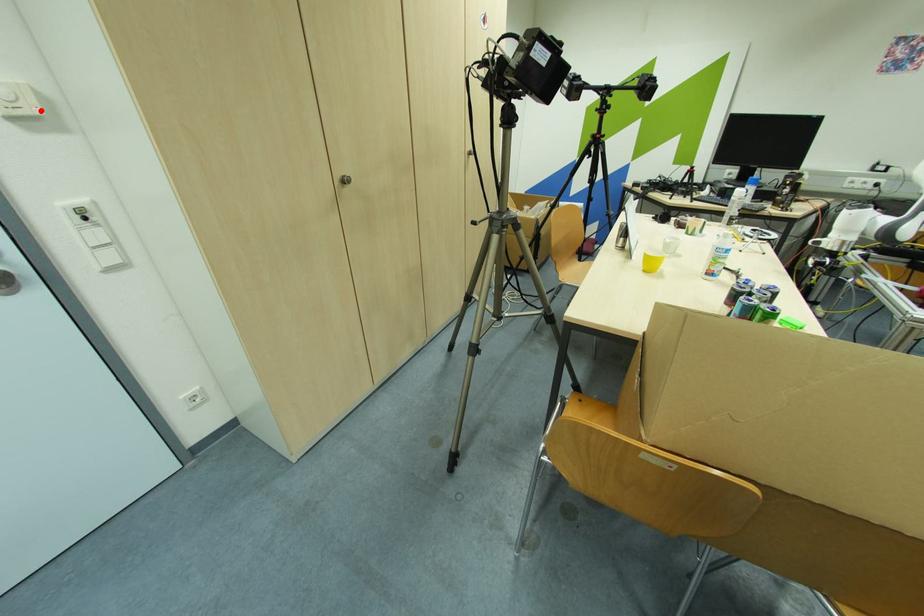
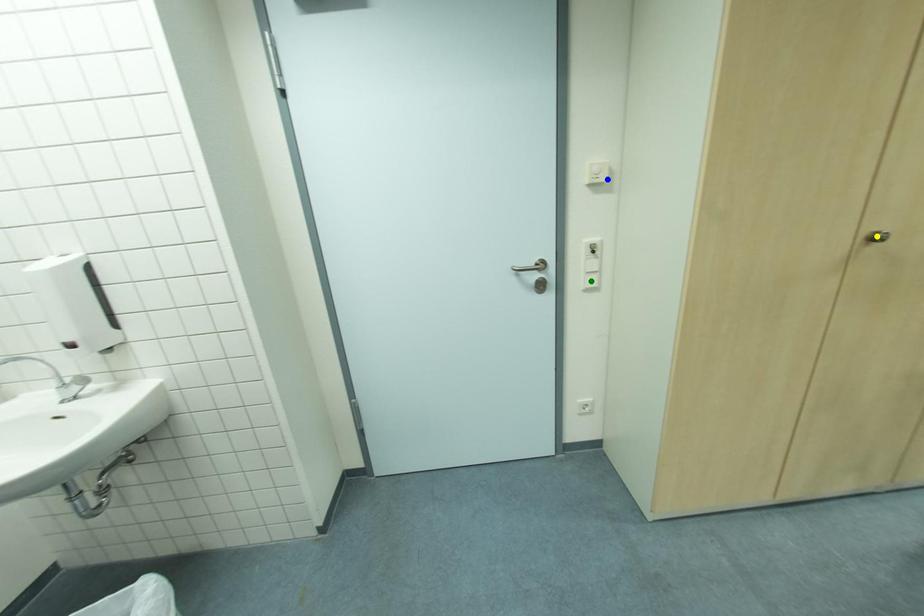
Question: I am providing you with two images of the same scene from different viewpoints. A red point is marked on the first image. You are given multiple points on the second image. Can you choose the point in image 2 that corresponds to the point in image 1?

Choices:
 (A) yellow point
 (B) blue point
 (C) green point

Answer: (B)